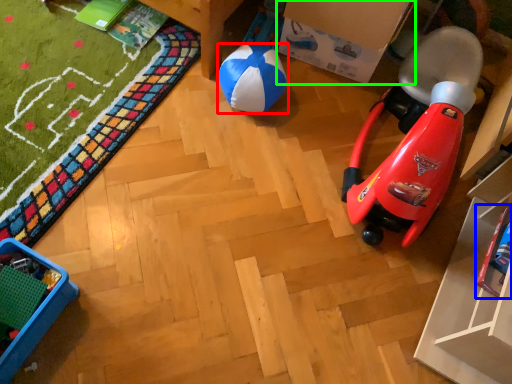
Question: Estimate the real-world distances between objects in this image. Which object is closer to ball (highlighted by a red box), toy (highlighted by a blue box) or cardboard box (highlighted by a green box)?

Choices:
 (A) toy
 (B) cardboard box

Answer: (B)